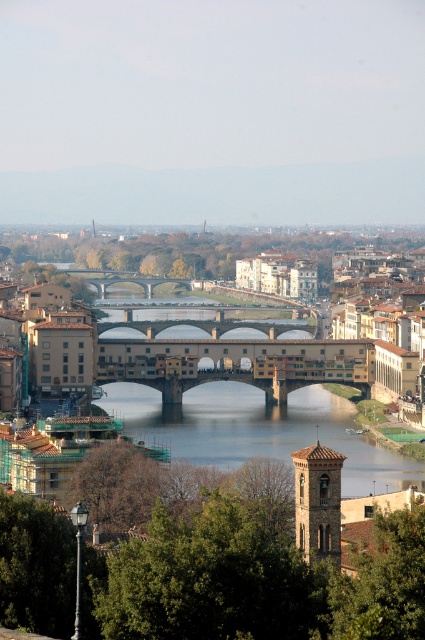
Is clear water at bridge center above brown stone bridge at center?

No, clear water at bridge center is not above brown stone bridge at center.

Is clear water at bridge center to the right of brown stone bridge at center from the viewer's perspective?

No, clear water at bridge center is not to the right of brown stone bridge at center.

Locate an element on the screen. The width and height of the screenshot is (425, 640). clear water at bridge center is located at coordinates (260, 429).

Locate an element on the screen. The image size is (425, 640). clear water at bridge center is located at coordinates (260, 429).

How much distance is there between brown stone bridge at center and stone arch bridge at center?

brown stone bridge at center and stone arch bridge at center are 67.17 meters apart from each other.

Is brown stone bridge at center positioned at the back of stone arch bridge at center?

No, it is in front of stone arch bridge at center.

Which is behind, point (333, 296) or point (142, 280)?

Positioned behind is point (142, 280).

You are a GUI agent. You are given a task and a screenshot of the screen. Output one action in this format:
    pyautogui.click(x=<x>, y=<y>)
    Task: Click on the brown stone bridge at center
    This screenshot has height=640, width=425.
    Given the screenshot: What is the action you would take?
    pyautogui.click(x=382, y=323)

Does clear water at bridge center have a lesser width compared to stone arch bridge at center?

No, clear water at bridge center is not thinner than stone arch bridge at center.

Which of these two, clear water at bridge center or stone arch bridge at center, stands shorter?

Standing shorter between the two is stone arch bridge at center.

Is point (402, 470) positioned after point (93, 282)?

No, it is not.

Locate an element on the screen. This screenshot has height=640, width=425. clear water at bridge center is located at coordinates (260, 429).